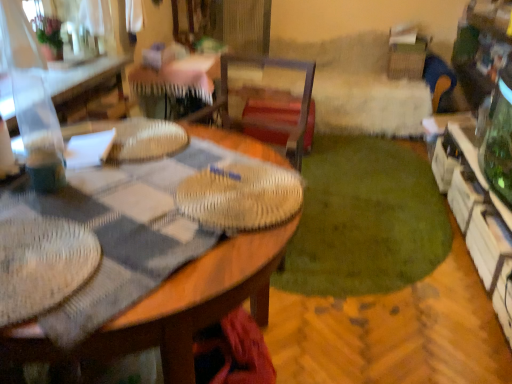
Question: Considering the relative positions of wooden table at upper left and white glossy cabinet at right in the image provided, is wooden table at upper left to the right of white glossy cabinet at right from the viewer's perspective?

Choices:
 (A) no
 (B) yes

Answer: (A)

Question: Is wooden table at upper left positioned before white glossy cabinet at right?

Choices:
 (A) no
 (B) yes

Answer: (A)

Question: From a real-world perspective, is wooden table at upper left over white glossy cabinet at right?

Choices:
 (A) yes
 (B) no

Answer: (A)

Question: Does wooden table at upper left have a lesser width compared to white glossy cabinet at right?

Choices:
 (A) yes
 (B) no

Answer: (A)

Question: From a real-world perspective, is wooden table at upper left physically below white glossy cabinet at right?

Choices:
 (A) no
 (B) yes

Answer: (A)

Question: From a real-world perspective, relative to wooden desk at center, is white glossy cabinet at right vertically above or below?

Choices:
 (A) below
 (B) above

Answer: (A)

Question: Based on their positions, is white glossy cabinet at right located to the left or right of wooden desk at center?

Choices:
 (A) left
 (B) right

Answer: (B)

Question: Relative to wooden desk at center, is white glossy cabinet at right in front or behind?

Choices:
 (A) front
 (B) behind

Answer: (B)

Question: In terms of width, does white glossy cabinet at right look wider or thinner when compared to wooden desk at center?

Choices:
 (A) wide
 (B) thin

Answer: (B)

Question: From the image's perspective, relative to green plush rug at center, is wooden desk at center above or below?

Choices:
 (A) above
 (B) below

Answer: (B)

Question: Does point (263, 261) appear closer or farther from the camera than point (351, 269)?

Choices:
 (A) farther
 (B) closer

Answer: (B)

Question: In the image, is wooden desk at center on the left side or the right side of green plush rug at center?

Choices:
 (A) right
 (B) left

Answer: (B)

Question: Considering the positions of wooden desk at center and green plush rug at center in the image, is wooden desk at center wider or thinner than green plush rug at center?

Choices:
 (A) thin
 (B) wide

Answer: (A)

Question: From their relative heights in the image, would you say green plush rug at center is taller or shorter than white glossy cabinet at right?

Choices:
 (A) tall
 (B) short

Answer: (B)

Question: In terms of size, does green plush rug at center appear bigger or smaller than white glossy cabinet at right?

Choices:
 (A) big
 (B) small

Answer: (B)